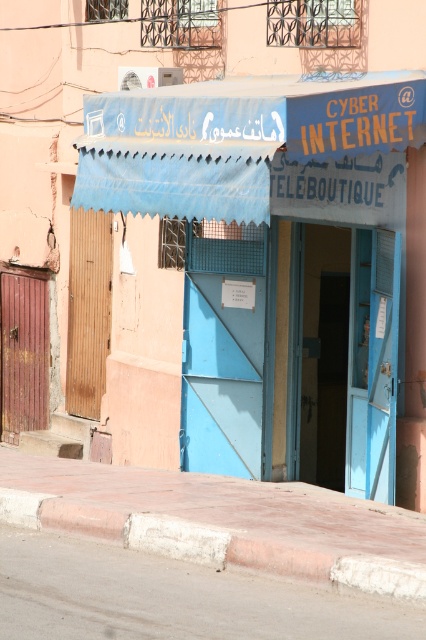
Does blue fabric canopy at upper center lie in front of concrete at lower center?

No.

Between point (187, 193) and point (206, 545), which one is positioned in front?

Point (206, 545)

The width and height of the screenshot is (426, 640). What do you see at coordinates (245, 145) in the screenshot?
I see `blue fabric canopy at upper center` at bounding box center [245, 145].

Locate an element on the screen. Image resolution: width=426 pixels, height=640 pixels. blue fabric canopy at upper center is located at coordinates (245, 145).

Can you confirm if blue painted door at center is positioned above blue fabric canopy at upper center?

Actually, blue painted door at center is below blue fabric canopy at upper center.

Measure the distance between point (195, 172) and camera.

Point (195, 172) is 40.16 feet from camera.

Identify the location of blue painted door at center. This screenshot has width=426, height=640. (276, 259).

Does blue painted door at center appear on the left side of concrete at lower center?

No, blue painted door at center is not to the left of concrete at lower center.

Looking at this image, is blue painted door at center wider than concrete at lower center?

Indeed, blue painted door at center has a greater width compared to concrete at lower center.

The image size is (426, 640). What are the coordinates of `blue painted door at center` in the screenshot? It's located at (276, 259).